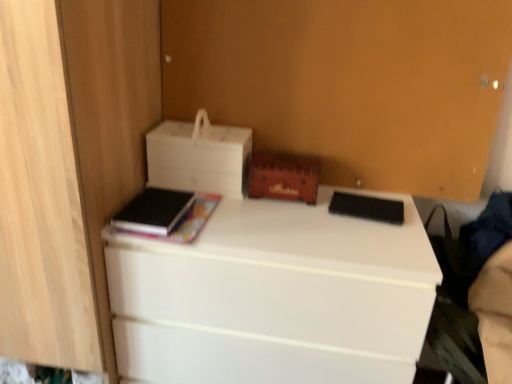
Question: From a real-world perspective, is white matte printer at upper left physically above black matte book at left, the 2th paperback book positioned from the right?

Choices:
 (A) no
 (B) yes

Answer: (B)

Question: From a real-world perspective, is white matte printer at upper left below black matte book at left, the 2th paperback book positioned from the right?

Choices:
 (A) no
 (B) yes

Answer: (A)

Question: Is white matte printer at upper left at the left side of black matte book at left, the 2th paperback book positioned from the right?

Choices:
 (A) yes
 (B) no

Answer: (B)

Question: Is white matte printer at upper left located outside black matte book at left, acting as the first paperback book starting from the left?

Choices:
 (A) no
 (B) yes

Answer: (B)

Question: From the image's perspective, would you say white matte printer at upper left is shown under black matte book at left, the 2th paperback book positioned from the right?

Choices:
 (A) yes
 (B) no

Answer: (B)

Question: Is white matte desk at center taller or shorter than wooden chest at center?

Choices:
 (A) short
 (B) tall

Answer: (B)

Question: Considering the positions of white matte desk at center and wooden chest at center in the image, is white matte desk at center wider or thinner than wooden chest at center?

Choices:
 (A) wide
 (B) thin

Answer: (A)

Question: Does point (386, 228) appear closer or farther from the camera than point (307, 162)?

Choices:
 (A) farther
 (B) closer

Answer: (B)

Question: From the image's perspective, is white matte desk at center located above or below wooden chest at center?

Choices:
 (A) below
 (B) above

Answer: (A)

Question: Considering the positions of white matte desk at center and black matte book at left, acting as the first paperback book starting from the left, in the image, is white matte desk at center wider or thinner than black matte book at left, acting as the first paperback book starting from the left,?

Choices:
 (A) thin
 (B) wide

Answer: (B)

Question: Does point (371, 193) appear closer or farther from the camera than point (137, 216)?

Choices:
 (A) farther
 (B) closer

Answer: (A)

Question: Choose the correct answer: Is white matte desk at center inside black matte book at left, acting as the first paperback book starting from the left, or outside it?

Choices:
 (A) outside
 (B) inside

Answer: (A)

Question: In terms of size, does white matte desk at center appear bigger or smaller than black matte book at left, the 2th paperback book positioned from the right?

Choices:
 (A) small
 (B) big

Answer: (B)

Question: Is white matte desk at center wider or thinner than white matte printer at upper left?

Choices:
 (A) thin
 (B) wide

Answer: (B)

Question: Is point (392, 294) positioned closer to the camera than point (237, 183)?

Choices:
 (A) farther
 (B) closer

Answer: (B)